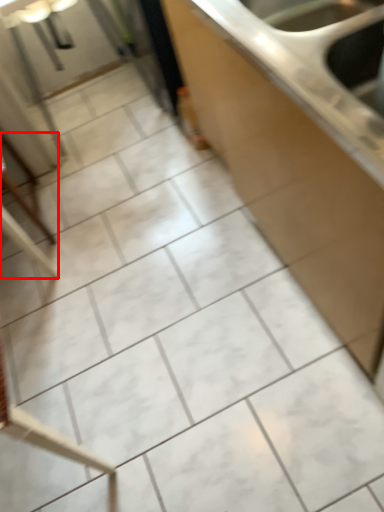
Question: In this image, where is furniture (annotated by the red box) located relative to countertop?

Choices:
 (A) right
 (B) left

Answer: (B)